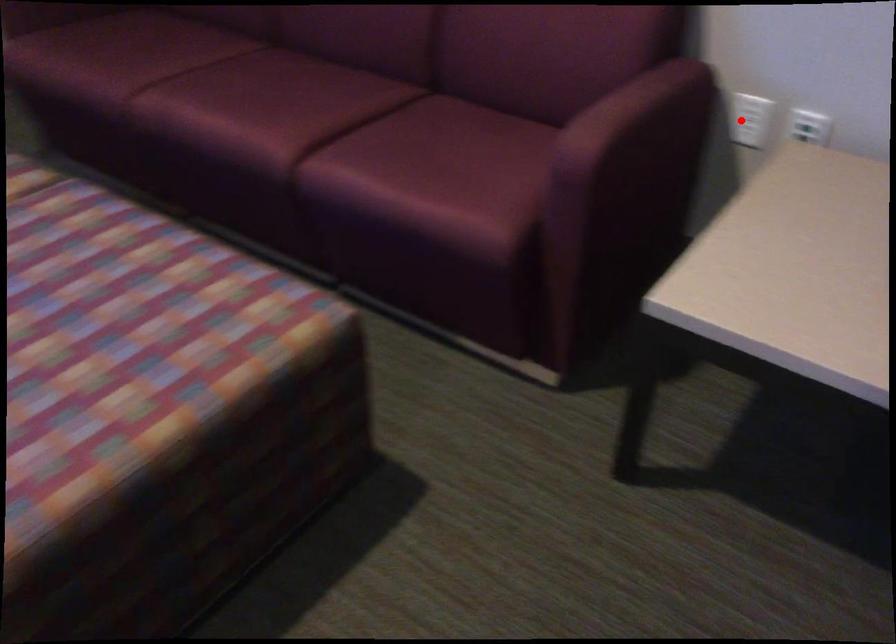
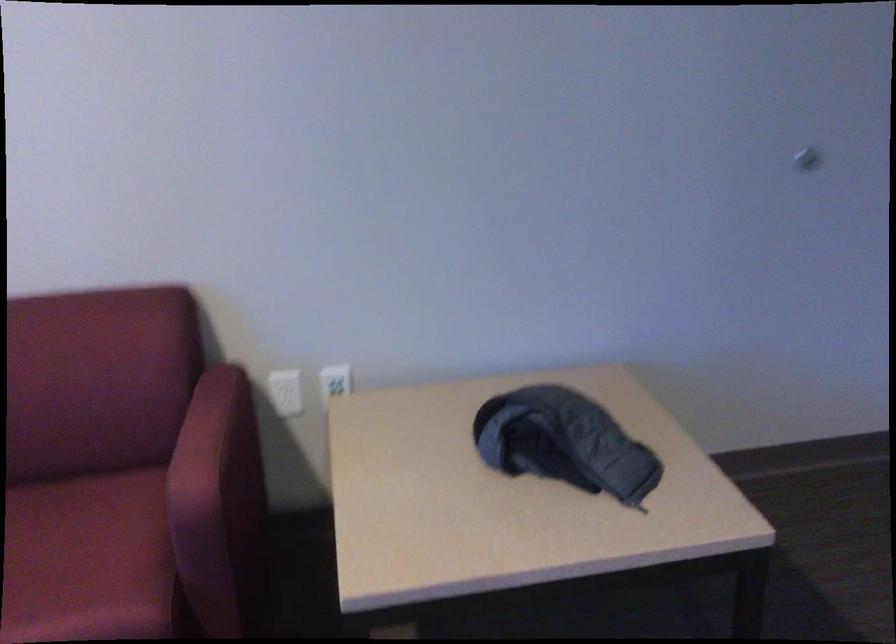
Locate, in the second image, the point that corresponds to the highlighted location in the first image.

(286, 392)